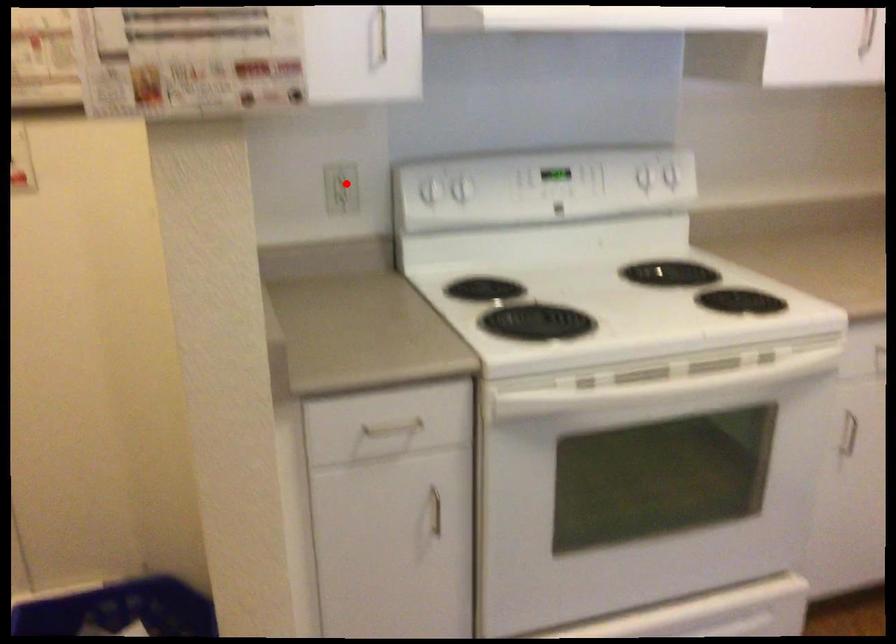
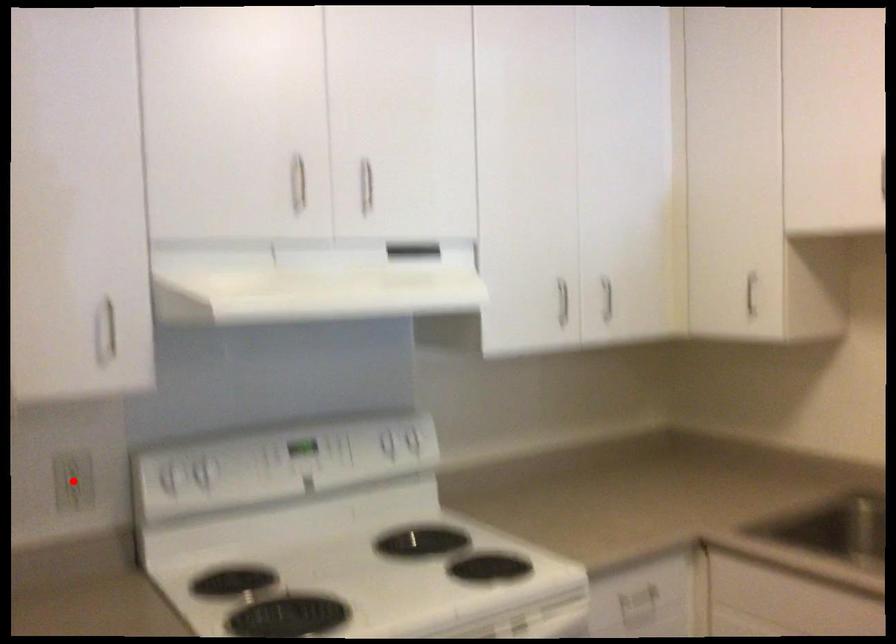
In the scene shown: I am providing you with two images of the same scene from different viewpoints. A red point is marked on the first image and another point is marked on the second image. Is the red point in image1 aligned with the point shown in image2?

Yes